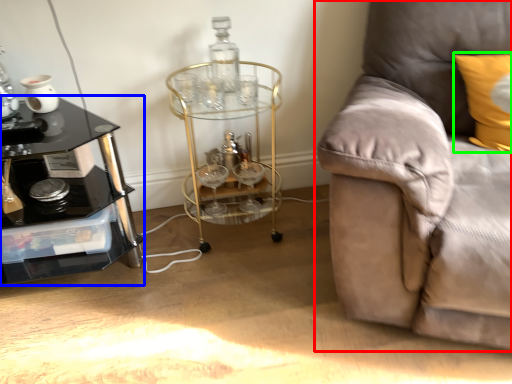
Question: Which object is positioned farthest from studio couch (highlighted by a red box)? Select from table (highlighted by a blue box) and pillow (highlighted by a green box).

Choices:
 (A) table
 (B) pillow

Answer: (A)